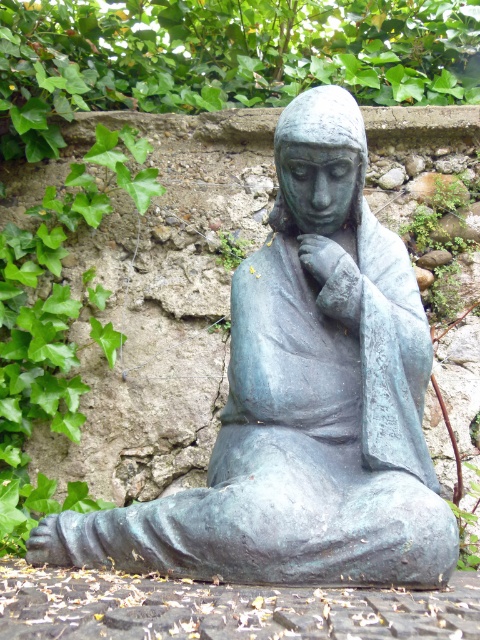
Question: Which object appears farthest from the camera in this image?

Choices:
 (A) bronze textured hand at center
 (B) bronze statue at center

Answer: (A)

Question: Which object is closer to the camera taking this photo?

Choices:
 (A) bronze textured hand at center
 (B) bronze statue at center

Answer: (B)

Question: Is bronze statue at center closer to camera compared to bronze textured hand at center?

Choices:
 (A) no
 (B) yes

Answer: (B)

Question: Is bronze statue at center thinner than bronze textured hand at center?

Choices:
 (A) yes
 (B) no

Answer: (B)

Question: From the image, what is the correct spatial relationship of bronze statue at center in relation to bronze textured hand at center?

Choices:
 (A) right
 (B) left

Answer: (B)